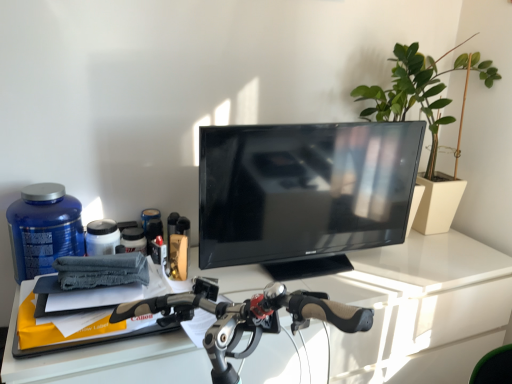
I want to click on free space in front of green matte plant at upper right, so click(x=404, y=260).